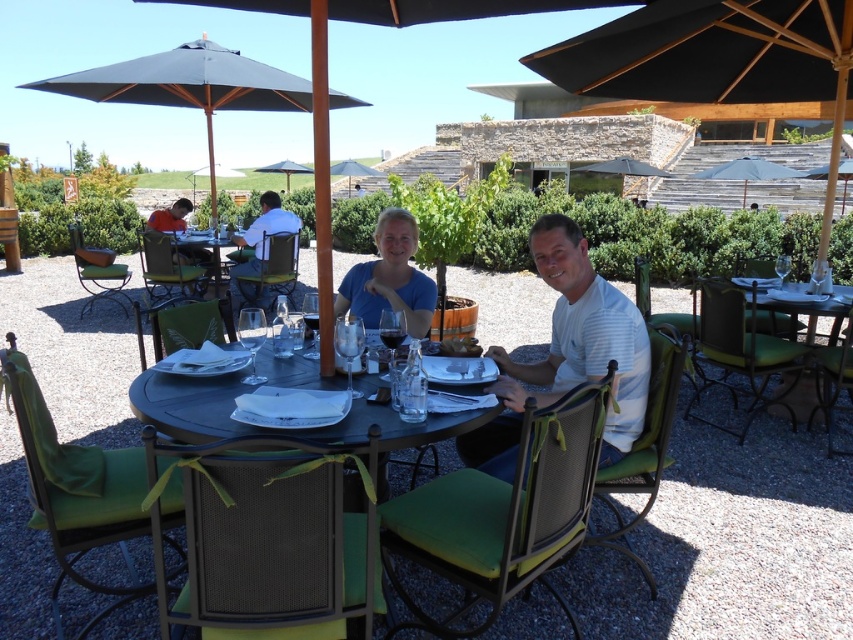
You are a photographer setting up a shot of the metallic dark gray table at center and the white shirt at center. Which object should you adjust to ensure both are in focus, considering their height difference?

The metallic dark gray table at center is shorter than the white shirt at center. To ensure both are in focus, adjust the camera angle to account for the height difference between the two objects.

Where is the metallic dark gray table at center located in the image?

The metallic dark gray table at center is located at point (189, 403).

You are a photographer wanting to capture the blue matte shirt at center without the black fabric umbrella at upper center casting a shadow on it. What adjustment should you make to the camera setup?

Move the camera setup so that the blue matte shirt at center is no longer under the black fabric umbrella at upper center, as the umbrella is currently positioned above it and casting a shadow.